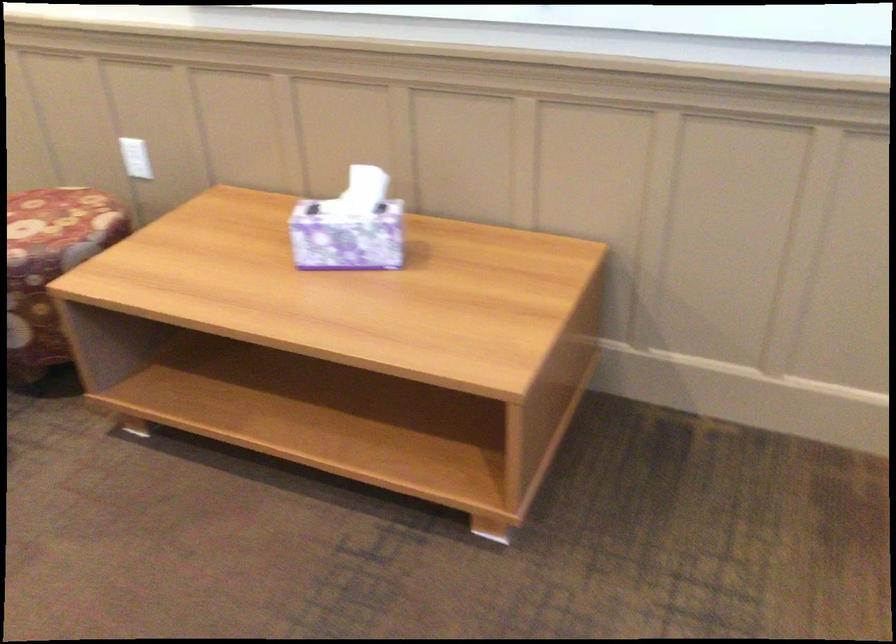
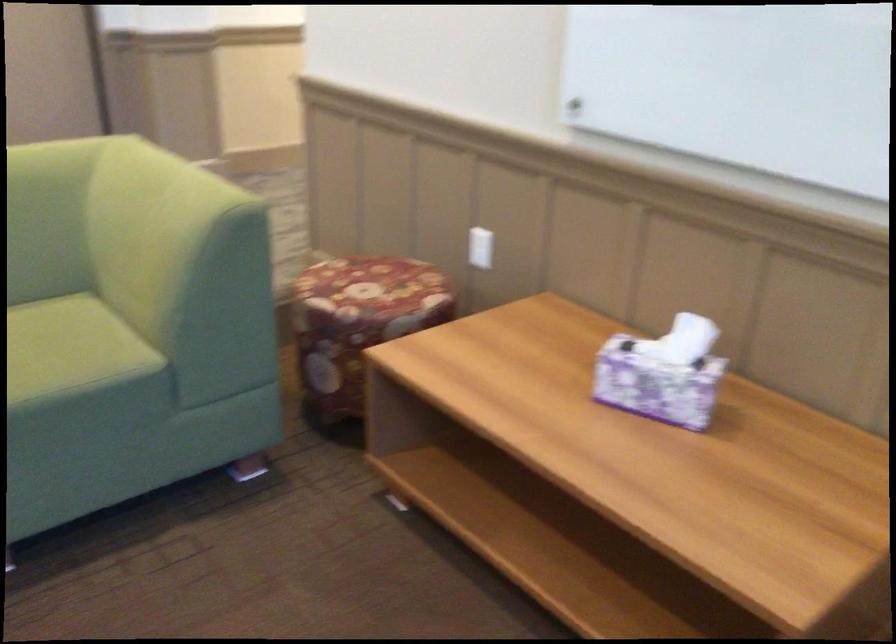
Where in the second image is the point corresponding to point (366, 194) from the first image?

(690, 341)